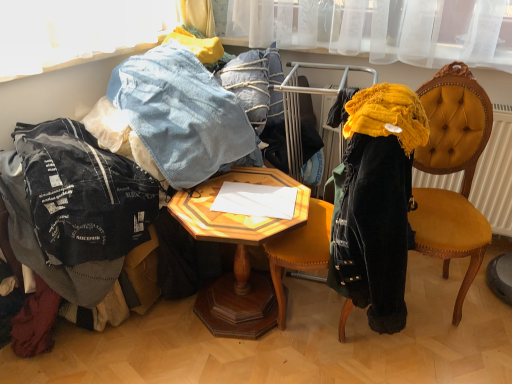
Image resolution: width=512 pixels, height=384 pixels. I want to click on vacant space situated above wooden hexagonal table at center (from a real-world perspective), so click(x=246, y=201).